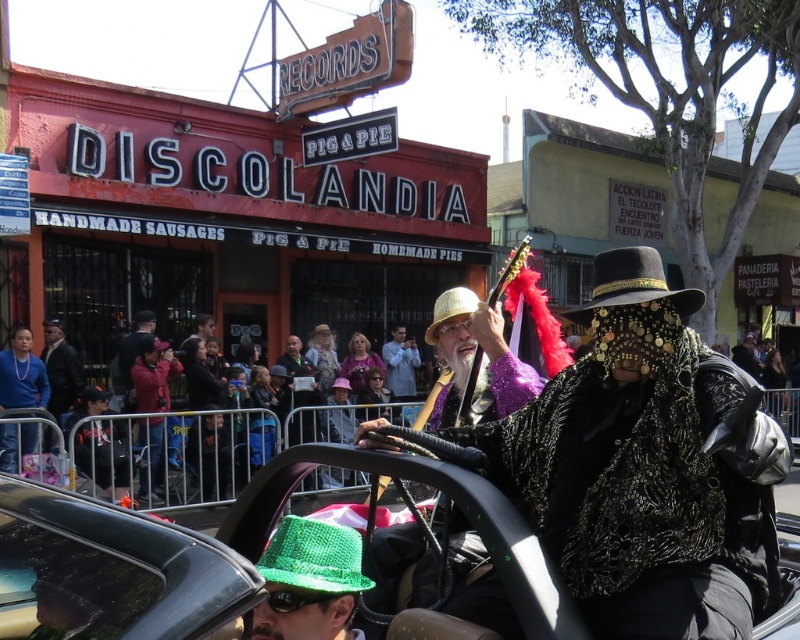
You are a photographer trying to capture both the green knitted hat at lower left and the gold metallic hat at center in a single shot. Based on their sizes in the image, which hat should you focus on to ensure both are clearly visible?

The green knitted hat at lower left occupies less space than the gold metallic hat at center. To ensure both are clearly visible, focus on the gold metallic hat at center as it is larger and will be easier to frame while still capturing the smaller green knitted hat at lower left in the shot.

You are a photographer standing at the back of the crowd behind the barricades. You want to take a photo of the shiny black car at center and the black sequined cowboy hat at center. Since the car is blocking the view of the hat, can you still see the hat in your photo?

The shiny black car at center is taller than the black sequined cowboy hat at center. Since the car is blocking the view, the hat might be obscured unless you adjust your angle to see above or around the car.

You are a photographer trying to capture a clear photo of the black sequined cowboy hat at center. However, there is a shiny black car at center in the way. Based on the scene description, can you still see the hat through the car?

The shiny black car at center is in front of the black sequined cowboy hat at center, so the car is blocking the view of the hat. You cannot see the hat through the car.